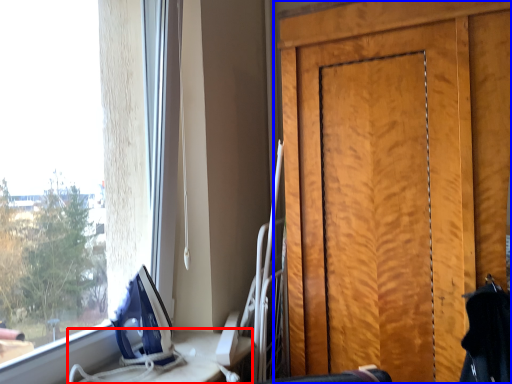
Question: Which object appears farthest to the camera in this image, table (highlighted by a red box) or door (highlighted by a blue box)?

Choices:
 (A) table
 (B) door

Answer: (B)